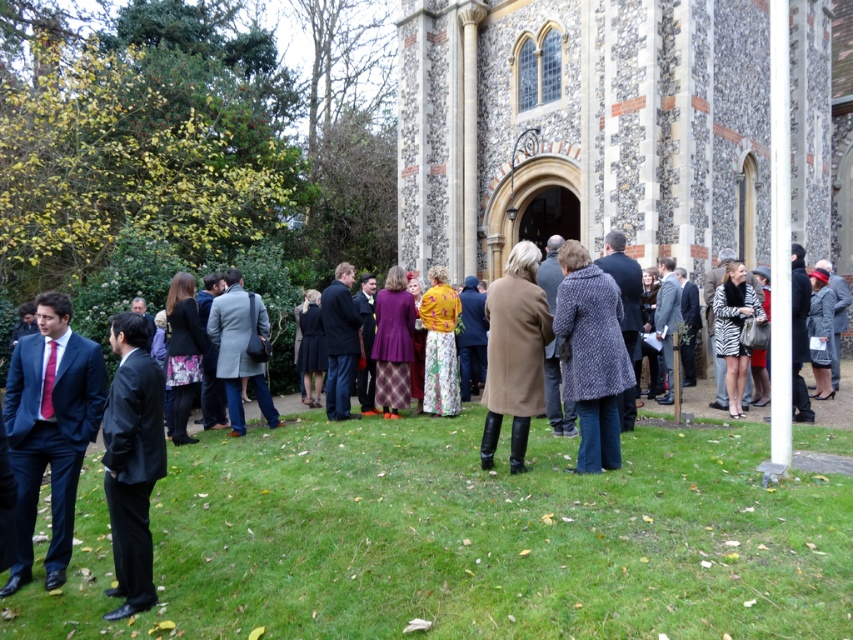
You are standing at the entrance of the church and want to find the light gray wool coat at center. According to the coordinates provided, where should you look relative to the entrance?

The light gray wool coat at center is located at coordinates point (239, 349), which would be slightly to the right and forward from the entrance.

You are a photographer at the event and want to ensure both coats are visible in your photo. Since the patterned wool coat at center is narrower than the matte brown coat at center, which coat should you position closer to the camera to avoid overlapping?

The patterned wool coat at center is narrower than the matte brown coat at center, so positioning the patterned wool coat at center closer to the camera will help avoid overlapping as it takes up less space.

You are standing at the church entrance and see two points marked in the image. Which point is closer to you, point (140, 408) or point (735, 390)?

Point (140, 408) is in front of point (735, 390), so it is closer to you.